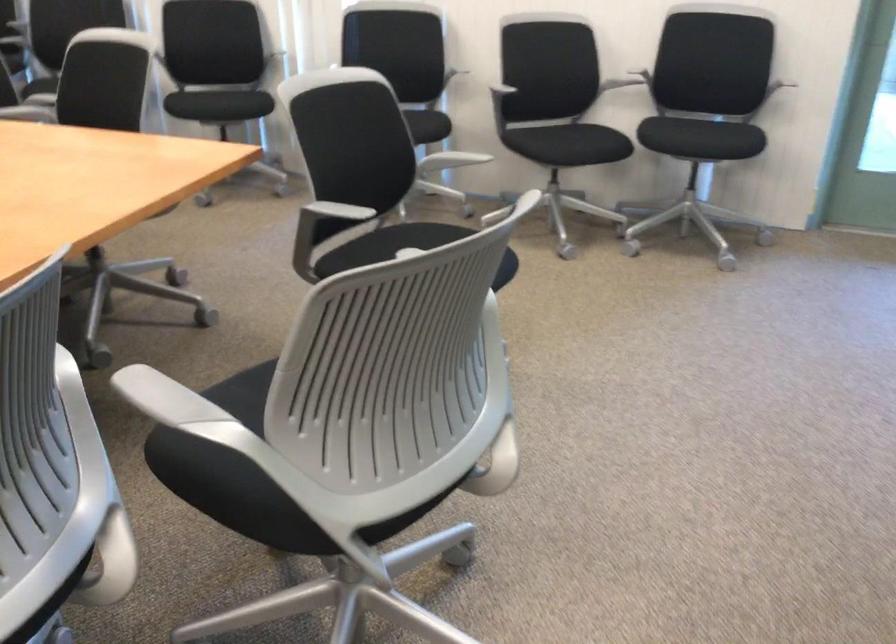
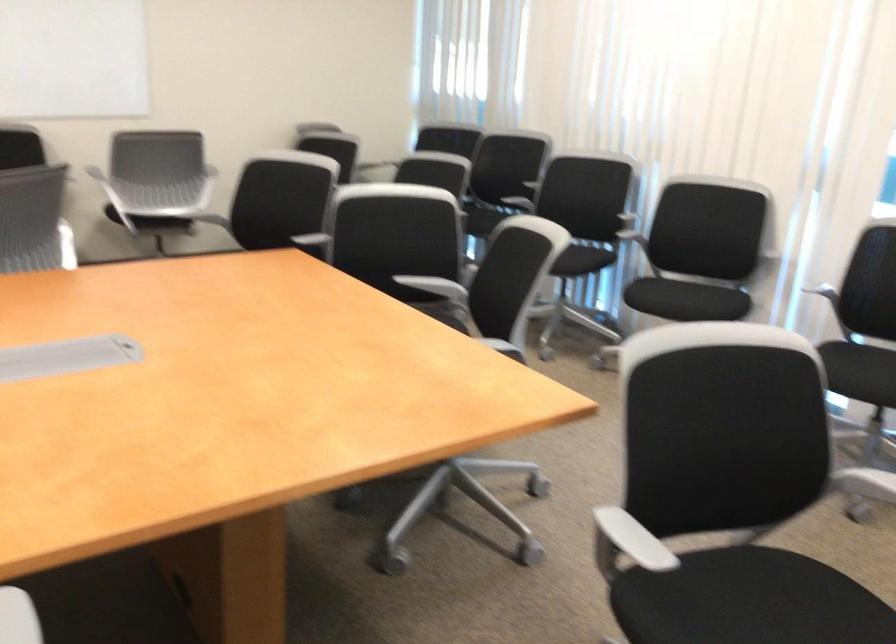
Question: The camera is either moving clockwise (left) or counter-clockwise (right) around the object. The first image is from the beginning of the video and the second image is from the end. Is the camera moving left or right when shooting the video?

Choices:
 (A) Left
 (B) Right

Answer: (B)